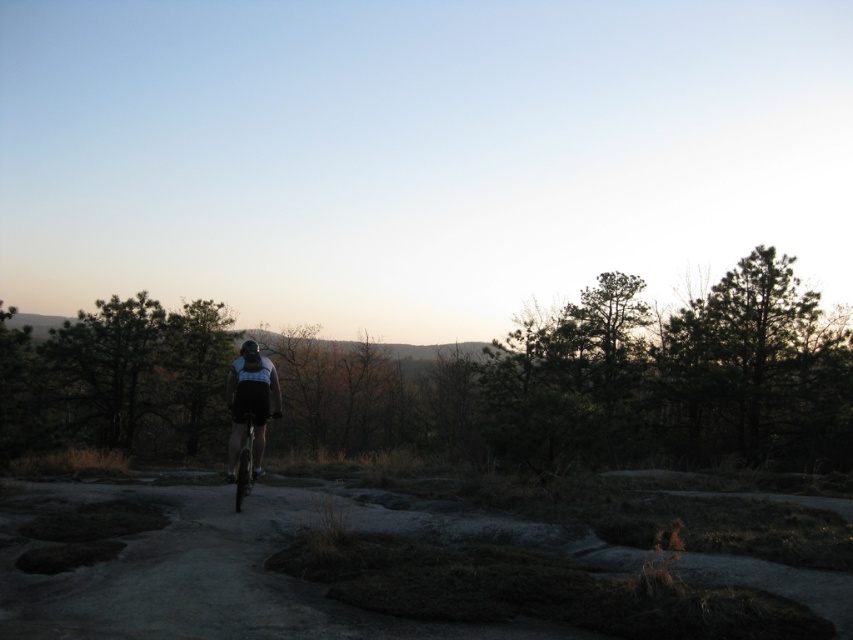
Question: Which of the following is the farthest from the observer?

Choices:
 (A) (244, 346)
 (B) (236, 509)

Answer: (A)

Question: Which point is farther to the camera?

Choices:
 (A) (260, 356)
 (B) (258, 360)
 (C) (238, 451)
 (D) (312, 596)

Answer: (A)

Question: Is matte black shorts at center further to camera compared to black matte helmet at center?

Choices:
 (A) no
 (B) yes

Answer: (A)

Question: Which point is farther from the camera taking this photo?

Choices:
 (A) (263, 356)
 (B) (247, 490)
 (C) (300, 506)

Answer: (C)

Question: Is matte black shorts at center to the left of metallic silver bicycle at center from the viewer's perspective?

Choices:
 (A) no
 (B) yes

Answer: (B)

Question: Does dull gray dirt track at center appear on the left side of metallic silver bicycle at center?

Choices:
 (A) no
 (B) yes

Answer: (A)